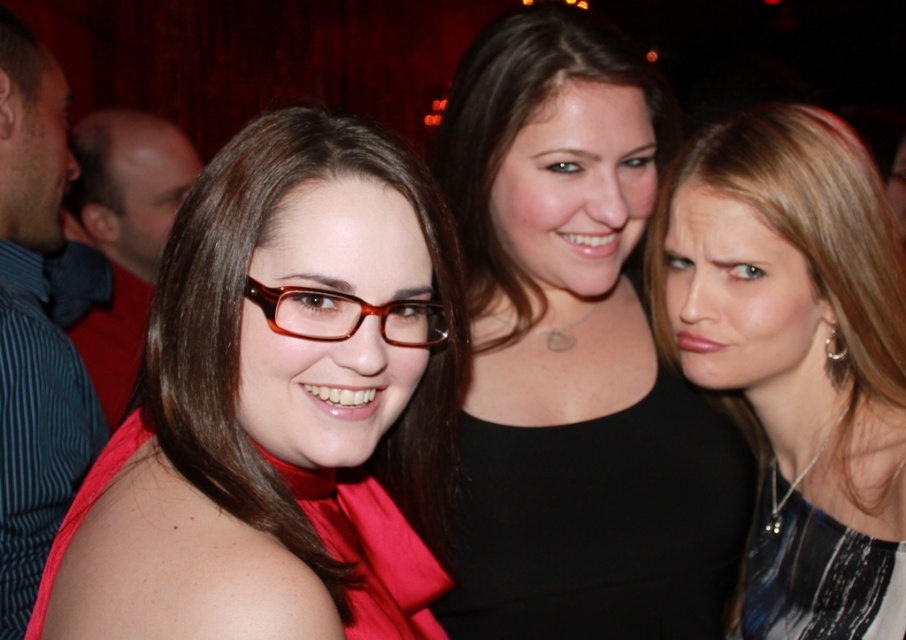
Question: Which object is positioned farthest from the shiny silver necklace at upper right?

Choices:
 (A) brown glossy glasses at center
 (B) matte red glasses at center
 (C) black silk dress at lower right

Answer: (A)

Question: Among these objects, which one is farthest from the camera?

Choices:
 (A) shiny silver necklace at upper right
 (B) black silk dress at lower right
 (C) matte red glasses at center

Answer: (A)

Question: Which of the following is the closest to the observer?

Choices:
 (A) (730, 472)
 (B) (712, 326)

Answer: (B)

Question: Is black silk dress at lower right bigger than brown glossy glasses at center?

Choices:
 (A) no
 (B) yes

Answer: (B)

Question: Where is black matte dress at center located in relation to black silk dress at lower right in the image?

Choices:
 (A) left
 (B) right

Answer: (A)

Question: Does matte red glasses at center have a lesser width compared to brown glossy glasses at center?

Choices:
 (A) yes
 (B) no

Answer: (B)